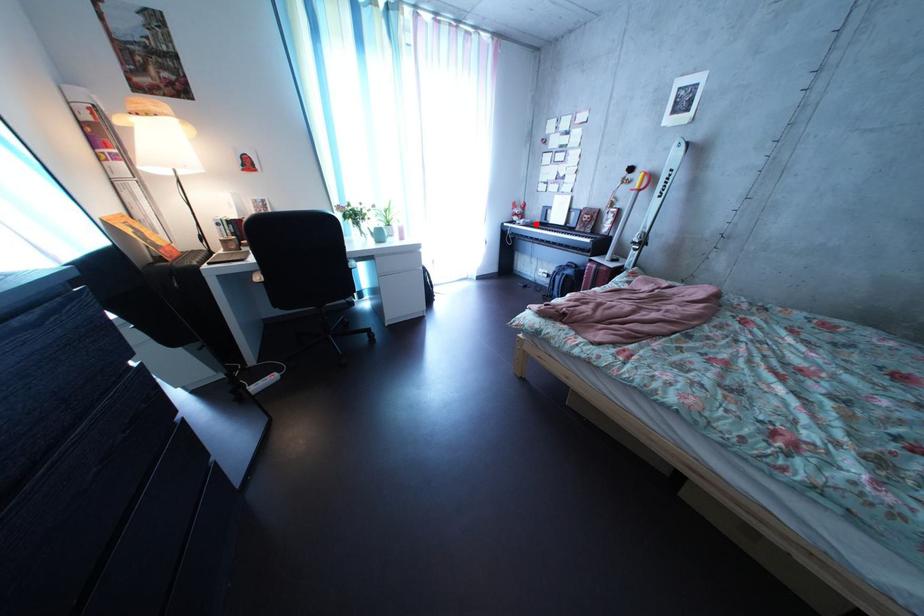
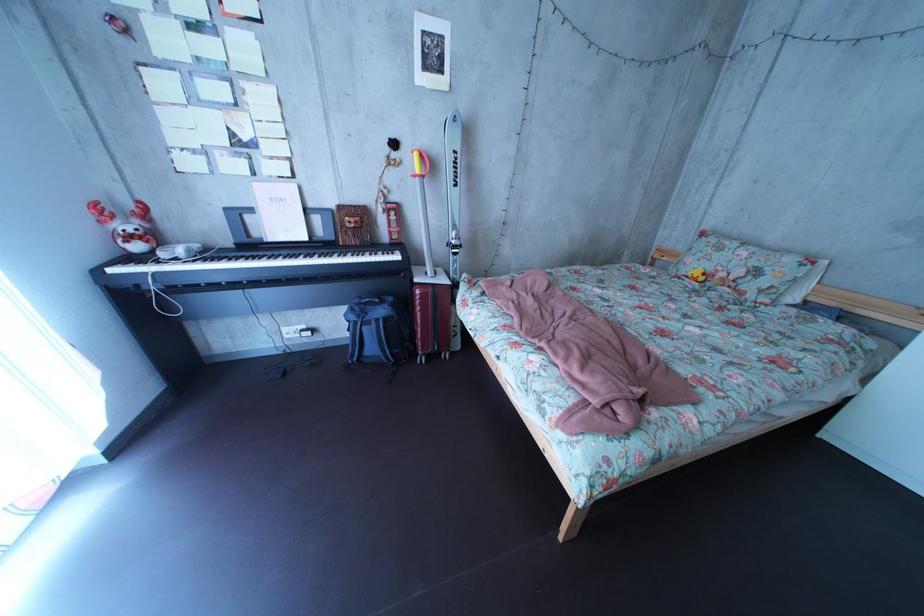
Question: I am providing you with two images of the same scene from different viewpoints. A red point is marked on the first image. At the location where the point appears in image 1, is it still visible in image 2?

Choices:
 (A) Yes
 (B) No

Answer: (A)